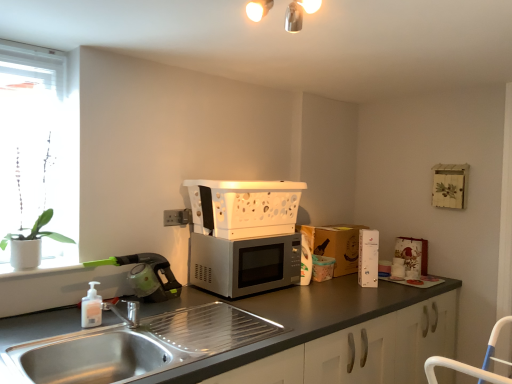
Where is `free point to the right of white matte soap dispenser at sink left`? This screenshot has height=384, width=512. free point to the right of white matte soap dispenser at sink left is located at coordinates (124, 317).